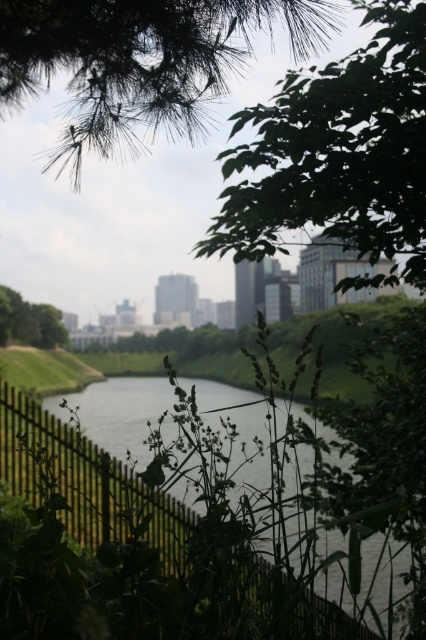
Can you confirm if green metal fence at lower center is positioned above green leafy tree at center?

No.

Is green metal fence at lower center taller than green leafy tree at center?

Result: Indeed, green metal fence at lower center has a greater height compared to green leafy tree at center.

Identify the location of green metal fence at lower center. 88,483.

Identify the location of green metal fence at lower center. This screenshot has height=640, width=426. (88, 483).

Between green leafy tree at upper center and green leafy tree at center, which one is positioned lower?

green leafy tree at center is lower down.

Does point (322, 170) come behind point (0, 323)?

No, it is not.

Between point (293, 184) and point (8, 305), which one is positioned behind?

The point (8, 305) is behind.

Find the location of `green leafy tree at upper center`. green leafy tree at upper center is located at coordinates (337, 150).

Does green leafy tree at upper center have a lesser height compared to green needle-like leaves at upper center?

In fact, green leafy tree at upper center may be taller than green needle-like leaves at upper center.

Is point (311, 81) positioned after point (17, 10)?

That is False.

Which is behind, point (420, 179) or point (144, 106)?

Point (144, 106)

Identify the location of green leafy tree at upper center. (337, 150).